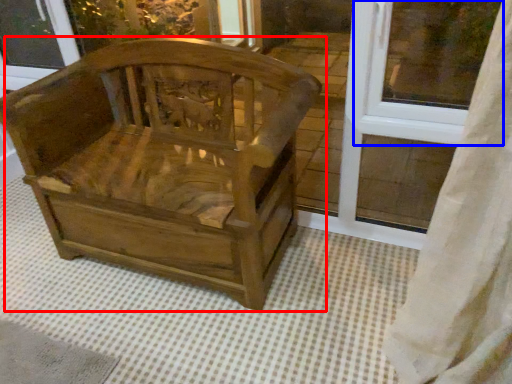
Question: Which of the following is the farthest to the observer, chair (highlighted by a red box) or window frame (highlighted by a blue box)?

Choices:
 (A) chair
 (B) window frame

Answer: (B)